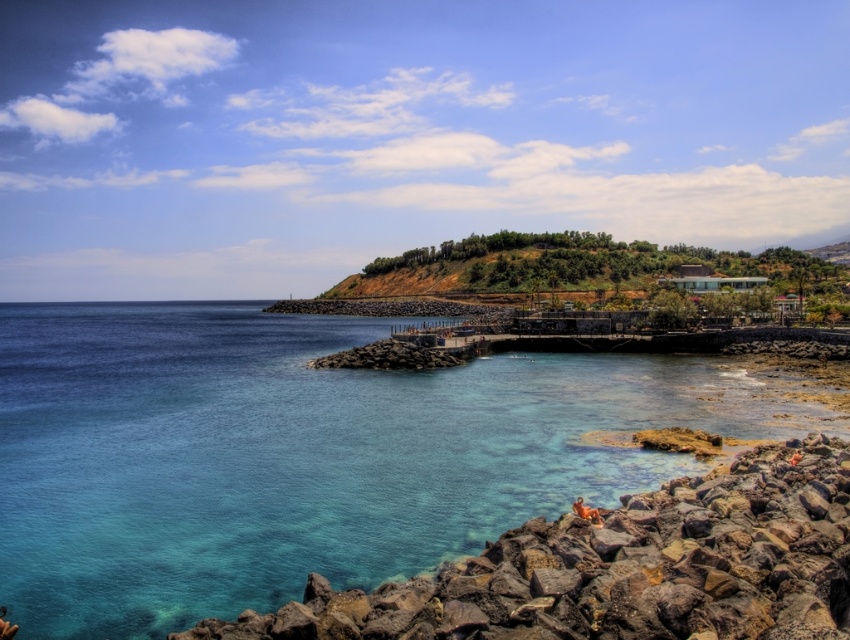
Question: Which object appears farthest from the camera in this image?

Choices:
 (A) green grassy hill at upper center
 (B) clear blue water at center

Answer: (A)

Question: Which object appears closest to the camera in this image?

Choices:
 (A) green grassy hill at upper center
 (B) clear blue water at center

Answer: (B)

Question: Is clear blue water at center smaller than green grassy hill at upper center?

Choices:
 (A) no
 (B) yes

Answer: (B)

Question: Which point is closer to the camera taking this photo?

Choices:
 (A) (582, 253)
 (B) (622, 563)

Answer: (B)

Question: Does clear blue water at center have a greater width compared to green grassy hill at upper center?

Choices:
 (A) no
 (B) yes

Answer: (A)

Question: Can you confirm if clear blue water at center is positioned to the right of rockyrough stonerocks at lower right?

Choices:
 (A) no
 (B) yes

Answer: (A)